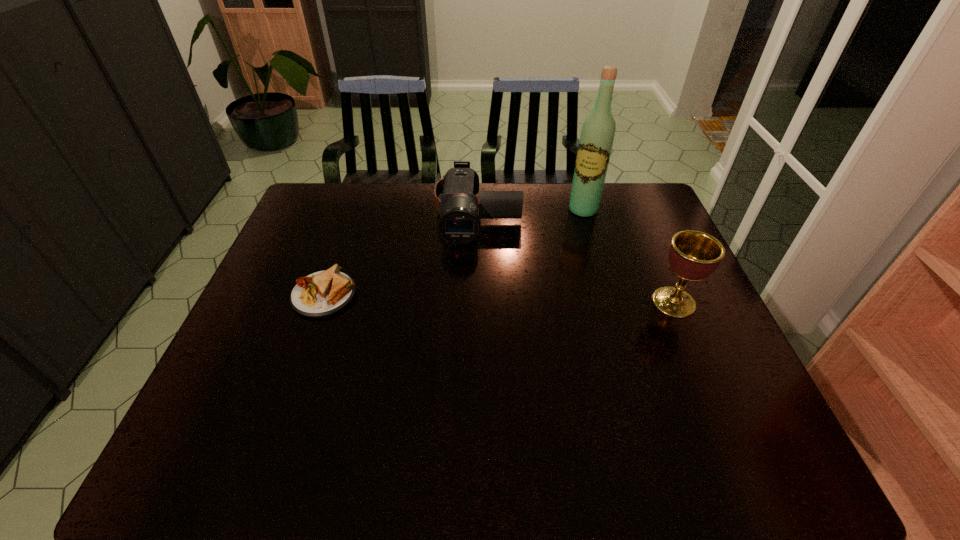
Locate an element on the screen. The height and width of the screenshot is (540, 960). free space between the shortest object and the third shortest object is located at coordinates (499, 299).

You are a GUI agent. You are given a task and a screenshot of the screen. Output one action in this format:
    pyautogui.click(x=<x>, y=<y>)
    Task: Click on the free space between the third shortest object and the shortest object
    
    Given the screenshot: What is the action you would take?
    pyautogui.click(x=499, y=299)

Identify the location of free space between the second shortest object and the chalice. This screenshot has width=960, height=540. (576, 258).

This screenshot has height=540, width=960. In order to click on vacant area that lies between the tallest object and the third tallest object in this screenshot , I will do `click(531, 212)`.

Locate an element on the screen. unoccupied area between the camcorder and the chalice is located at coordinates (576, 258).

Identify which object is the nearest to the chalice. Please provide its 2D coordinates. Your answer should be formatted as a tuple, i.e. [(x, y)], where the tuple contains the x and y coordinates of a point satisfying the conditions above.

[(597, 135)]

This screenshot has height=540, width=960. In order to click on object that stands as the closest to the wine bottle in this screenshot , I will do `click(459, 223)`.

Image resolution: width=960 pixels, height=540 pixels. I want to click on vacant space that satisfies the following two spatial constraints: 1. on the back side of the leftmost object; 2. on the right side of the third tallest object, so click(352, 214).

Locate an element on the screen. This screenshot has height=540, width=960. free region that satisfies the following two spatial constraints: 1. on the front side of the chalice; 2. on the left side of the second object from left to right is located at coordinates (477, 302).

Locate an element on the screen. vacant space that satisfies the following two spatial constraints: 1. on the back side of the camcorder; 2. on the right side of the third object from left to right is located at coordinates (478, 210).